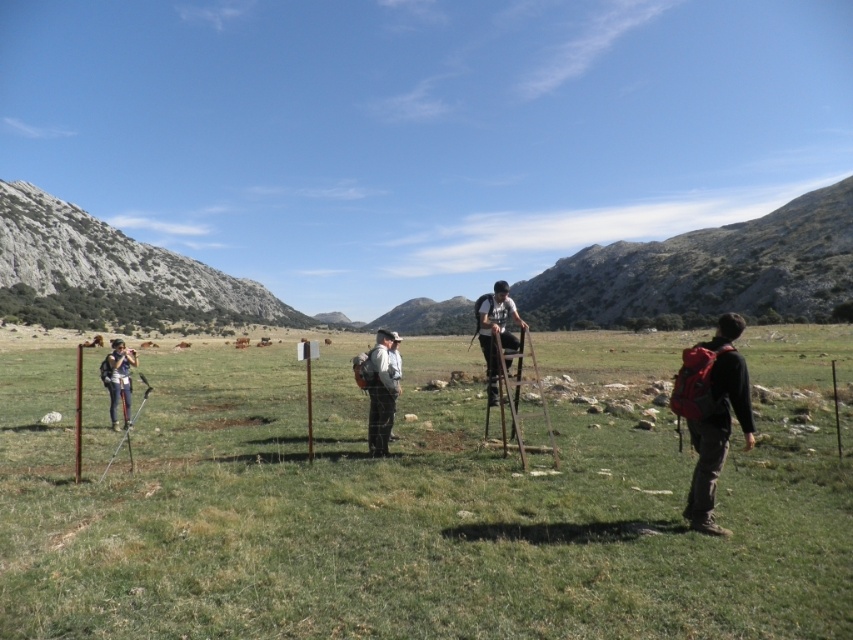
You are a photographer standing in the green grassy field at center and want to take a picture of the white fabric shirt at center. Which object is wider so that it can be the main focus of the photo?

The green grassy field at center is wider than the white fabric shirt at center, so it can be the main focus of the photo.

You are planning to set up a temporary research station in the green grassy field at center. The station requires a clear line of sight to the gray rocky mountain at left for communication purposes. Given that the distance between them is 212.50 meters, can you confirm if the setup will allow for uninterrupted communication?

The green grassy field at center is 212.50 meters from the gray rocky mountain at left. Since there are no obstacles mentioned in the scene description between them, the setup should allow for uninterrupted communication.

In the scene shown: You are a hiker planning to cross the green grassy field at center and reach the gray rocky mountain at left. Based on the scene, which object is taller?

The gray rocky mountain at left is taller than the green grassy field at center.